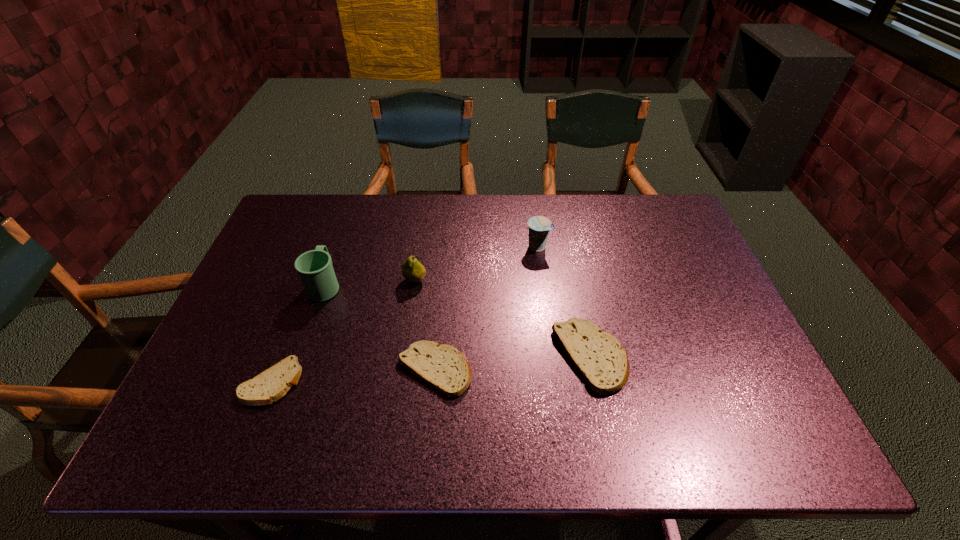
You are a GUI agent. You are given a task and a screenshot of the screen. Output one action in this format:
    pyautogui.click(x=<x>, y=<y>)
    Task: Click on the vacant space at the near edge of the desktop
    The width and height of the screenshot is (960, 540).
    Given the screenshot: What is the action you would take?
    pyautogui.click(x=507, y=401)

You are a GUI agent. You are given a task and a screenshot of the screen. Output one action in this format:
    pyautogui.click(x=<x>, y=<y>)
    Task: Click on the free space at the left edge of the desktop
    The height and width of the screenshot is (540, 960).
    Given the screenshot: What is the action you would take?
    pyautogui.click(x=233, y=308)

You are a GUI agent. You are given a task and a screenshot of the screen. Output one action in this format:
    pyautogui.click(x=<x>, y=<y>)
    Task: Click on the vacant space at the right edge of the desktop
    The height and width of the screenshot is (540, 960).
    Given the screenshot: What is the action you would take?
    click(x=733, y=337)

Where is `vacant area at the far left corner of the desktop`? The image size is (960, 540). vacant area at the far left corner of the desktop is located at coordinates coord(314,213).

Where is `vacant region at the far right corner`? vacant region at the far right corner is located at coordinates (647, 230).

This screenshot has height=540, width=960. I want to click on free space at the near right corner of the desktop, so click(x=748, y=377).

The image size is (960, 540). I want to click on unoccupied position between the rightmost pita bread and the yogurt, so click(x=564, y=302).

Locate an element on the screen. This screenshot has height=540, width=960. vacant area between the mug and the farthest object is located at coordinates click(431, 266).

At what (x,y) coordinates should I click in order to perform the action: click on free spot between the mug and the pear. Please return your answer as a coordinate pair (x, y). This screenshot has height=540, width=960. Looking at the image, I should click on (371, 283).

Where is `vacant space that is in between the pear and the mug`? The image size is (960, 540). vacant space that is in between the pear and the mug is located at coordinates (371, 283).